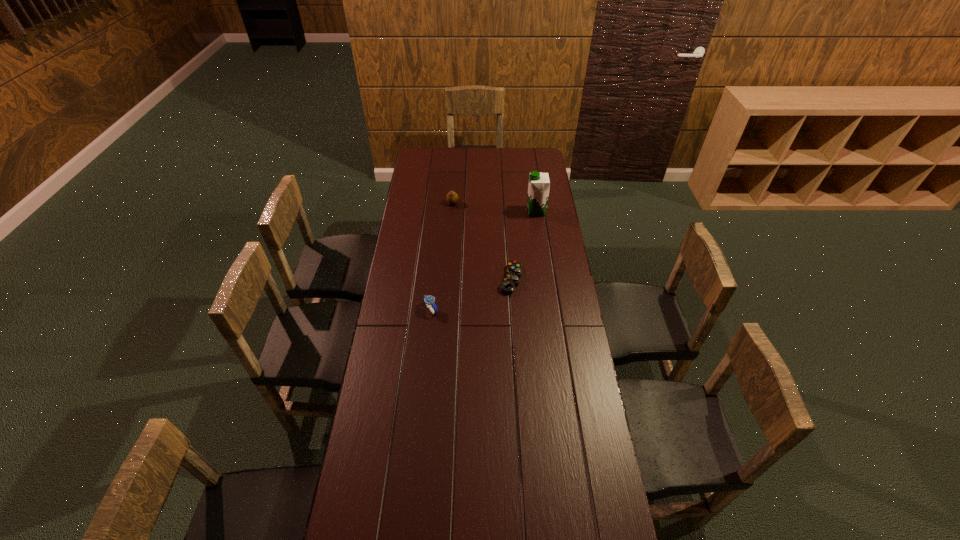
Locate an element on the screen. This screenshot has height=540, width=960. soya milk is located at coordinates [x=539, y=184].

The height and width of the screenshot is (540, 960). What are the coordinates of `the tallest object` in the screenshot? It's located at (539, 184).

Find the location of a particular element. Image resolution: width=960 pixels, height=540 pixels. pear is located at coordinates (452, 198).

I want to click on the nearest object, so click(x=429, y=300).

Locate an element on the screen. watch is located at coordinates (429, 300).

Image resolution: width=960 pixels, height=540 pixels. Identify the location of the third farthest object. (511, 280).

You are a GUI agent. You are given a task and a screenshot of the screen. Output one action in this format:
    pyautogui.click(x=<x>, y=<y>)
    Task: Click on the control
    
    Given the screenshot: What is the action you would take?
    pyautogui.click(x=511, y=280)

You are a GUI agent. You are given a task and a screenshot of the screen. Output one action in this format:
    pyautogui.click(x=<x>, y=<y>)
    Task: Click on the free region located on the front-facing side of the rightmost object
    The image size is (960, 540).
    Given the screenshot: What is the action you would take?
    pyautogui.click(x=477, y=212)

Where is `blank area located 0.350m on the front-facing side of the rightmost object`? The image size is (960, 540). blank area located 0.350m on the front-facing side of the rightmost object is located at coordinates (460, 212).

Where is `vacant region located on the front-facing side of the rightmost object`? Image resolution: width=960 pixels, height=540 pixels. vacant region located on the front-facing side of the rightmost object is located at coordinates (473, 212).